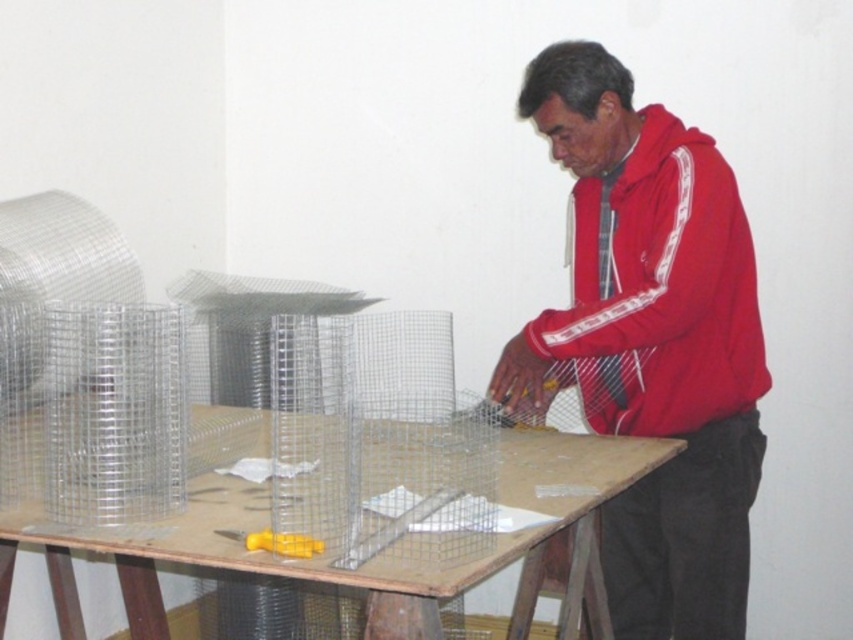
What do you see at coordinates (651, 340) in the screenshot? The height and width of the screenshot is (640, 853). I see `red matte jacket at center` at bounding box center [651, 340].

Where is `red matte jacket at center`? Image resolution: width=853 pixels, height=640 pixels. red matte jacket at center is located at coordinates (651, 340).

Can you confirm if red matte jacket at center is taller than yellow plastic screwdriver at center?

Yes, red matte jacket at center is taller than yellow plastic screwdriver at center.

Does red matte jacket at center have a lesser height compared to yellow plastic screwdriver at center?

No, red matte jacket at center is not shorter than yellow plastic screwdriver at center.

At what (x,y) coordinates should I click in order to perform the action: click on red matte jacket at center. Please return your answer as a coordinate pair (x, y). Looking at the image, I should click on (651, 340).

Does red matte jacket at center have a greater width compared to red fleece jacket at center?

Yes.

Does point (549, 54) lie behind point (741, 301)?

Yes, point (549, 54) is behind point (741, 301).

Which is in front, point (611, 230) or point (672, 426)?

Point (672, 426) is more forward.

This screenshot has width=853, height=640. I want to click on red matte jacket at center, so click(651, 340).